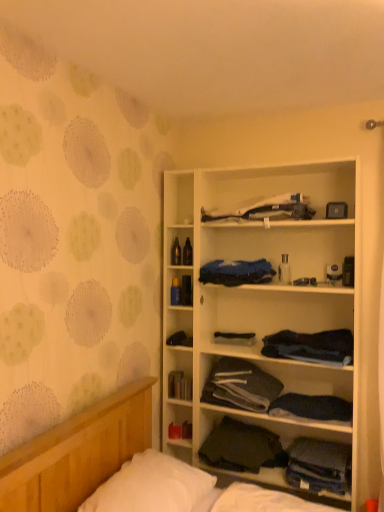
Question: Considering the relative sizes of dark gray fabric at center, positioned as the second clothing in bottom-to-top order, and white wood cabinet at center in the image provided, is dark gray fabric at center, positioned as the second clothing in bottom-to-top order, thinner than white wood cabinet at center?

Choices:
 (A) yes
 (B) no

Answer: (B)

Question: Can you confirm if dark gray fabric at center, positioned as the second clothing in bottom-to-top order, is positioned to the left of white wood cabinet at center?

Choices:
 (A) no
 (B) yes

Answer: (B)

Question: Are dark gray fabric at center, the seventh clothing viewed from the top, and white wood cabinet at center located far from each other?

Choices:
 (A) no
 (B) yes

Answer: (A)

Question: From the image's perspective, would you say dark gray fabric at center, the seventh clothing viewed from the top, is positioned over white wood cabinet at center?

Choices:
 (A) no
 (B) yes

Answer: (A)

Question: Is dark gray fabric at center, the seventh clothing viewed from the top, wider than white wood cabinet at center?

Choices:
 (A) yes
 (B) no

Answer: (A)

Question: Is dark gray fabric at center, the seventh clothing viewed from the top, looking in the opposite direction of white wood cabinet at center?

Choices:
 (A) no
 (B) yes

Answer: (B)

Question: Is there a large distance between dark blue fabric at center, which is the second clothing in top-to-bottom order, and dark blue fabric at center, the 3th clothing from the top?

Choices:
 (A) no
 (B) yes

Answer: (A)

Question: From the image's perspective, would you say dark blue fabric at center, acting as the seventh clothing starting from the bottom, is shown under dark blue fabric at center, the 3th clothing from the top?

Choices:
 (A) no
 (B) yes

Answer: (A)

Question: Does dark blue fabric at center, acting as the seventh clothing starting from the bottom, have a lesser width compared to dark blue fabric at center, the 3th clothing from the top?

Choices:
 (A) yes
 (B) no

Answer: (B)

Question: Is dark blue fabric at center, acting as the seventh clothing starting from the bottom, positioned beyond the bounds of dark blue fabric at center, the 3th clothing from the top?

Choices:
 (A) yes
 (B) no

Answer: (A)

Question: Can you confirm if dark blue fabric at center, which is the second clothing in top-to-bottom order, is positioned to the left of dark blue fabric at center, the 6th clothing ordered from the bottom?

Choices:
 (A) no
 (B) yes

Answer: (B)

Question: Is dark blue fabric at center, which is the second clothing in top-to-bottom order, shorter than dark blue fabric at center, the 3th clothing from the top?

Choices:
 (A) yes
 (B) no

Answer: (B)

Question: Does dark gray fabric at center, the seventh clothing viewed from the top, lie behind white soft pillow at lower left?

Choices:
 (A) yes
 (B) no

Answer: (A)